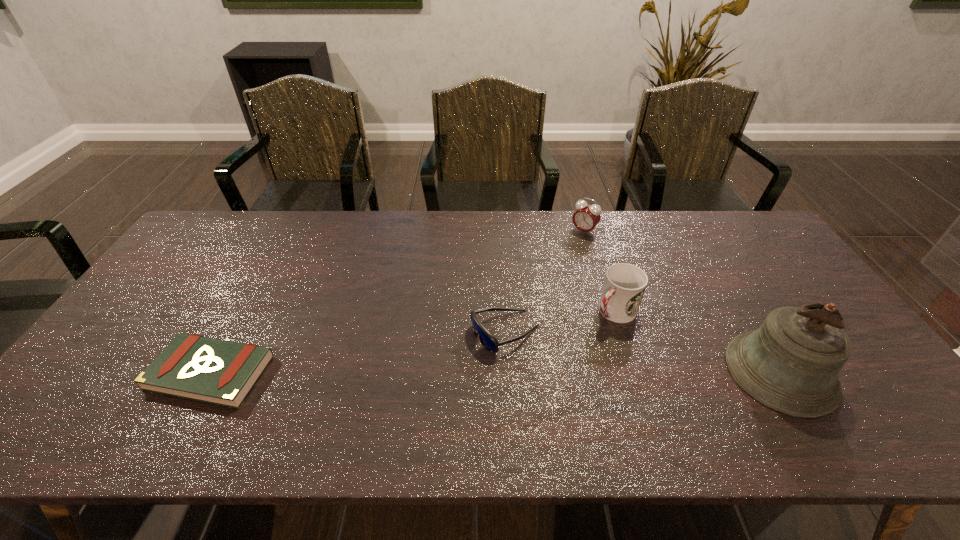
Identify the location of free spot on the desktop that is between the shortest object and the bell and is positioned on the handle side of the cup. (547, 372).

The image size is (960, 540). In order to click on vacant spot on the desktop that is between the shortest object and the rightmost object and is positioned on the clock face of the alarm clock in this screenshot , I will do `click(467, 373)`.

This screenshot has height=540, width=960. What are the coordinates of `vacant spot on the desktop that is between the leftmost object and the bell and is positioned on the front-facing side of the fourth object from right to left` in the screenshot? It's located at (419, 373).